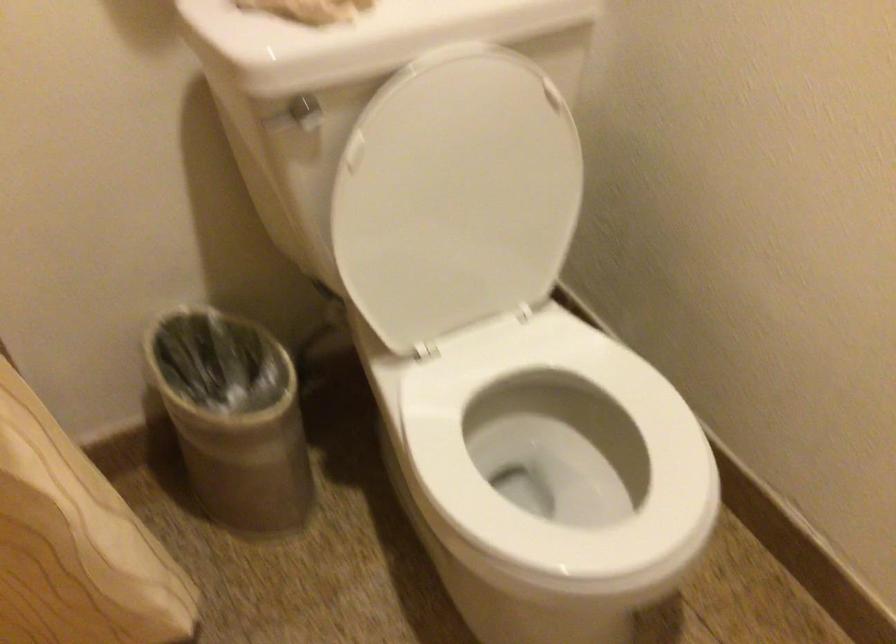
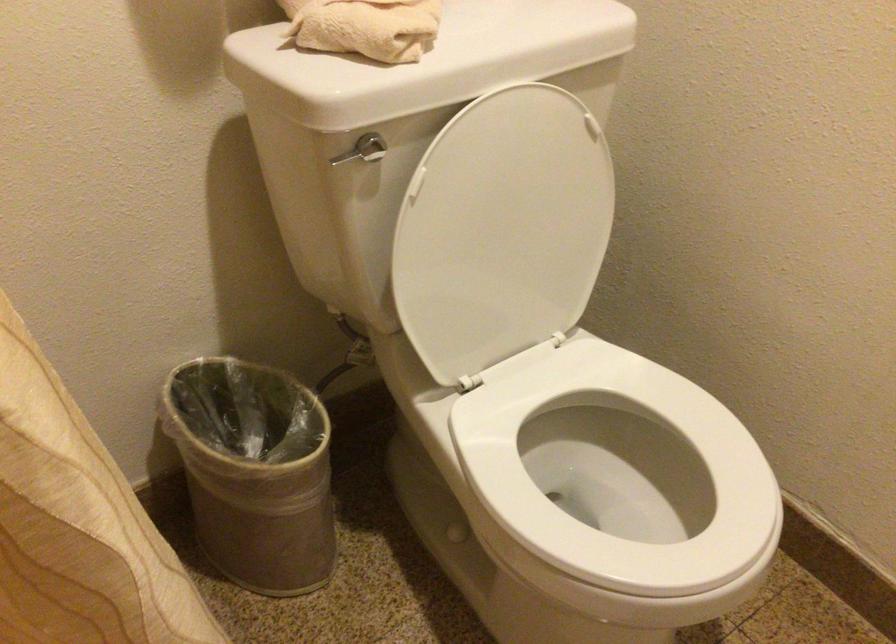
Locate, in the second image, the point that corresponds to point (282, 125) in the first image.

(348, 155)